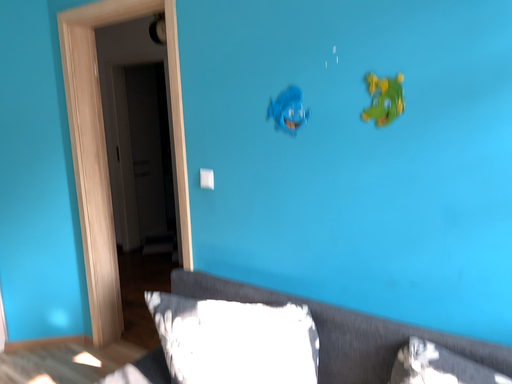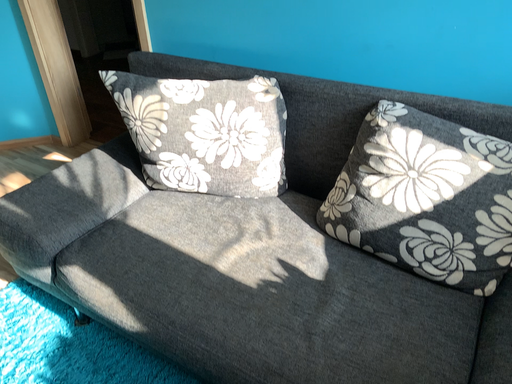
Question: How did the camera likely rotate when shooting the video?

Choices:
 (A) rotated downward
 (B) rotated upward

Answer: (A)